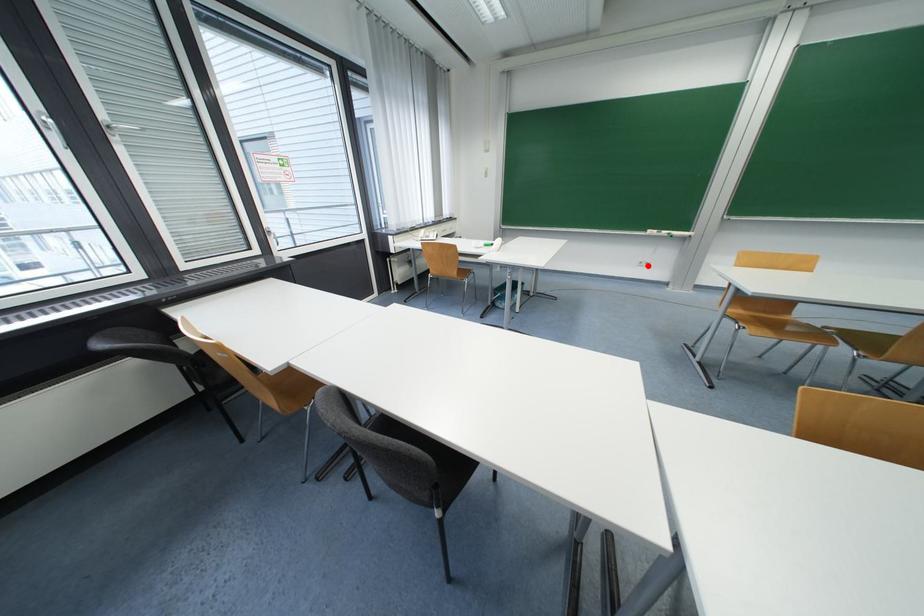
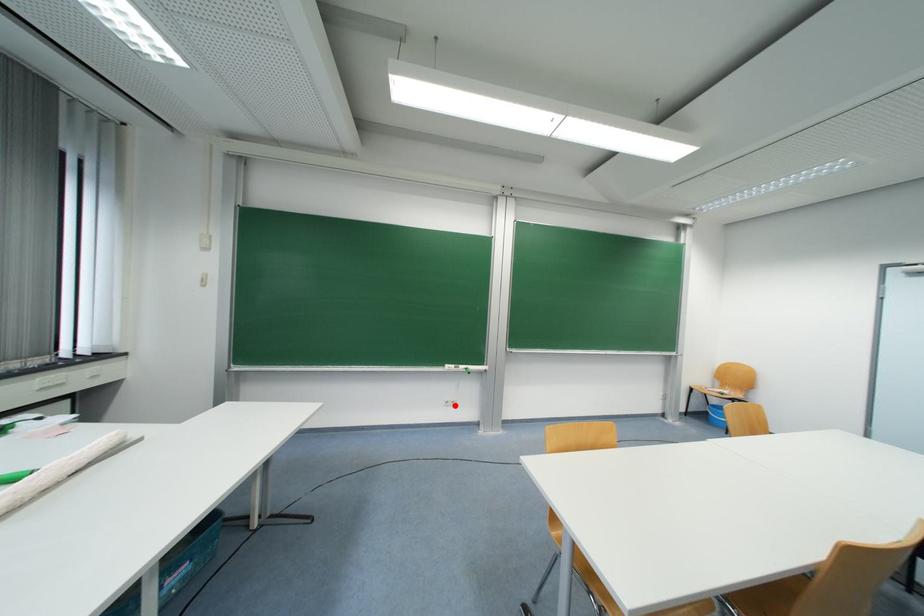
I am providing you with two images of the same scene from different viewpoints. A red point is marked on the first image and another point is marked on the second image. Is the marked point in image1 the same physical position as the marked point in image2?

Yes